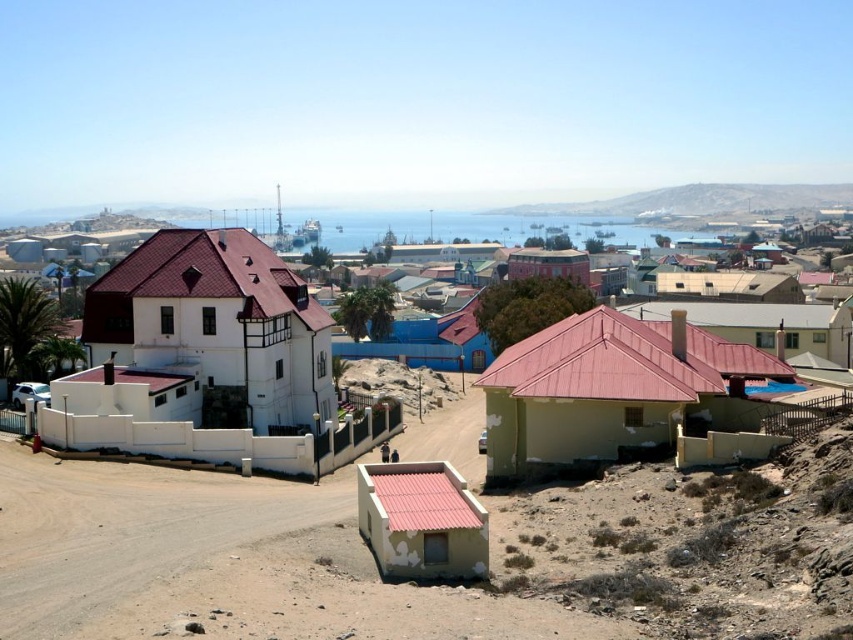
Which is more to the left, yellow matte house at lower right or white matte house at left?

white matte house at left is more to the left.

Can you confirm if yellow matte house at lower right is smaller than white matte house at left?

Yes.

Describe the element at coordinates (621, 396) in the screenshot. This screenshot has height=640, width=853. I see `yellow matte house at lower right` at that location.

Identify the location of yellow matte house at lower right. The width and height of the screenshot is (853, 640). (621, 396).

Is white matte house at center to the right of matte red building at center from the viewer's perspective?

In fact, white matte house at center is to the left of matte red building at center.

The image size is (853, 640). I want to click on white matte house at center, so click(207, 362).

Between point (264, 317) and point (550, 257), which one is positioned behind?

Point (550, 257)

You are a GUI agent. You are given a task and a screenshot of the screen. Output one action in this format:
    pyautogui.click(x=<x>, y=<y>)
    Task: Click on the white matte house at center
    The image size is (853, 640).
    Given the screenshot: What is the action you would take?
    pyautogui.click(x=207, y=362)

In the scene shown: Who is more forward, (283, 465) or (251, 385)?

Point (283, 465)

From the picture: Can you confirm if white matte house at center is positioned to the right of white matte house at left?

Correct, you'll find white matte house at center to the right of white matte house at left.

Who is more distant from viewer, (380, 408) or (259, 259)?

The point (380, 408) is behind.

The image size is (853, 640). What are the coordinates of `white matte house at center` in the screenshot? It's located at (207, 362).